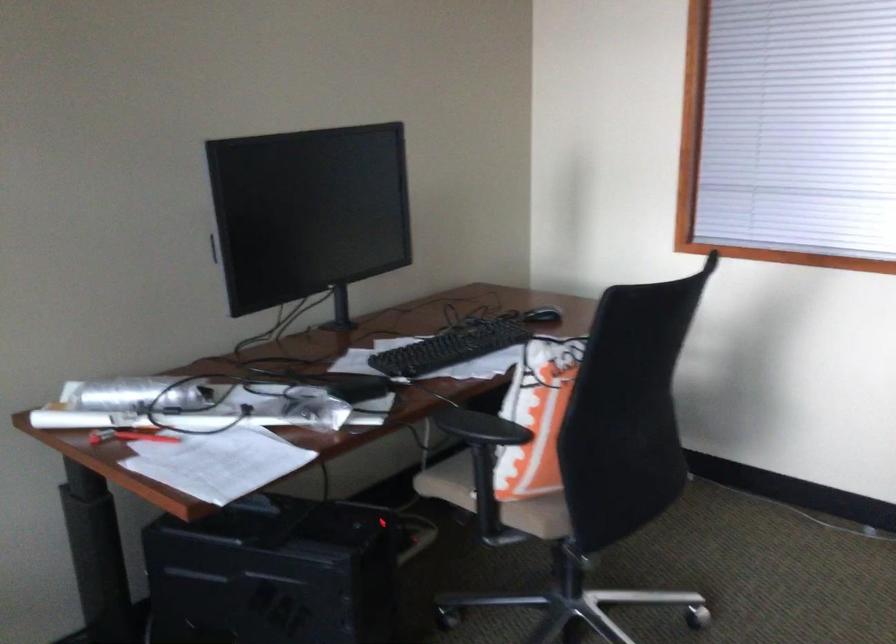
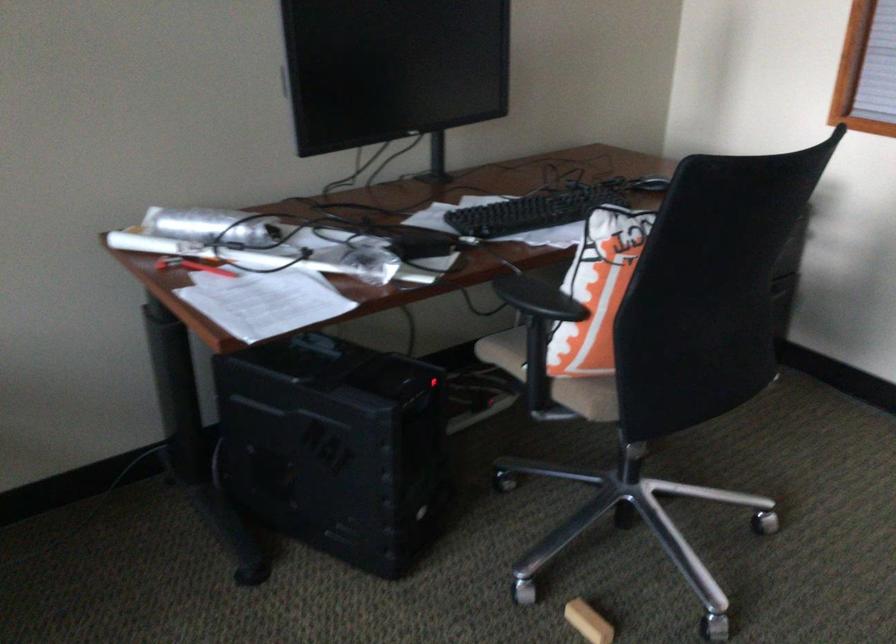
Locate, in the second image, the point that corresponds to [130,436] in the first image.

(192, 266)